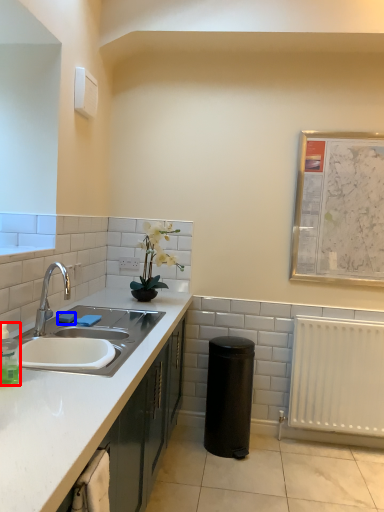
Question: Which object appears farthest to the camera in this image, bottle (highlighted by a red box) or soap (highlighted by a blue box)?

Choices:
 (A) bottle
 (B) soap

Answer: (B)